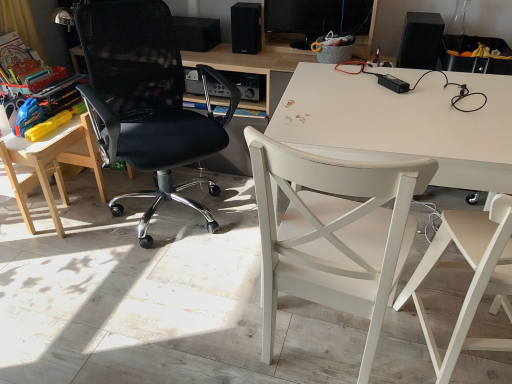
At what (x,y) coordinates should I click in order to perform the action: click on free area in between white wood chair at center, the 3th chair viewed from the left, and black mesh office chair at left, the second chair from the left. Please return your answer as a coordinate pair (x, y). This screenshot has height=384, width=512. Looking at the image, I should click on (218, 273).